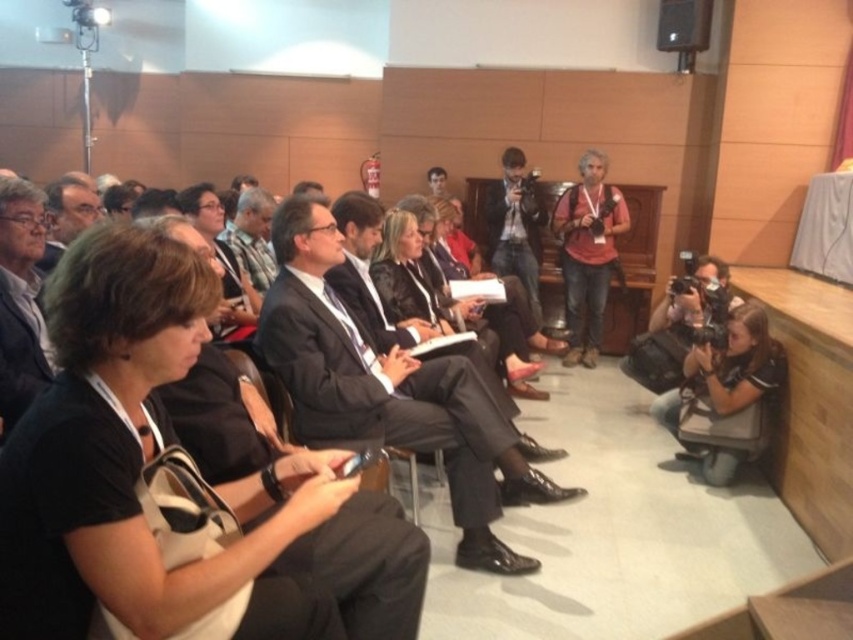
Question: Which point is farther to the camera?

Choices:
 (A) matte black camera at center
 (B) matte black suit at center
 (C) red cotton shirt at center

Answer: (C)

Question: Where is black fabric shirt at left located in relation to red cotton shirt at center in the image?

Choices:
 (A) right
 (B) left

Answer: (B)

Question: Can you confirm if red cotton shirt at center is positioned to the left of matte black camera at center?

Choices:
 (A) yes
 (B) no

Answer: (B)

Question: Which object is the farthest from the matte black camera at center?

Choices:
 (A) red cotton shirt at center
 (B) matte black suit at center
 (C) black fabric shirt at left

Answer: (C)

Question: Does black leather jacket at center have a greater width compared to matte black speaker at upper right?

Choices:
 (A) no
 (B) yes

Answer: (B)

Question: Which object is the farthest from the matte black speaker at upper right?

Choices:
 (A) black leather jacket at center
 (B) black fabric shirt at left
 (C) red cotton shirt at center
 (D) matte black camera at center

Answer: (B)